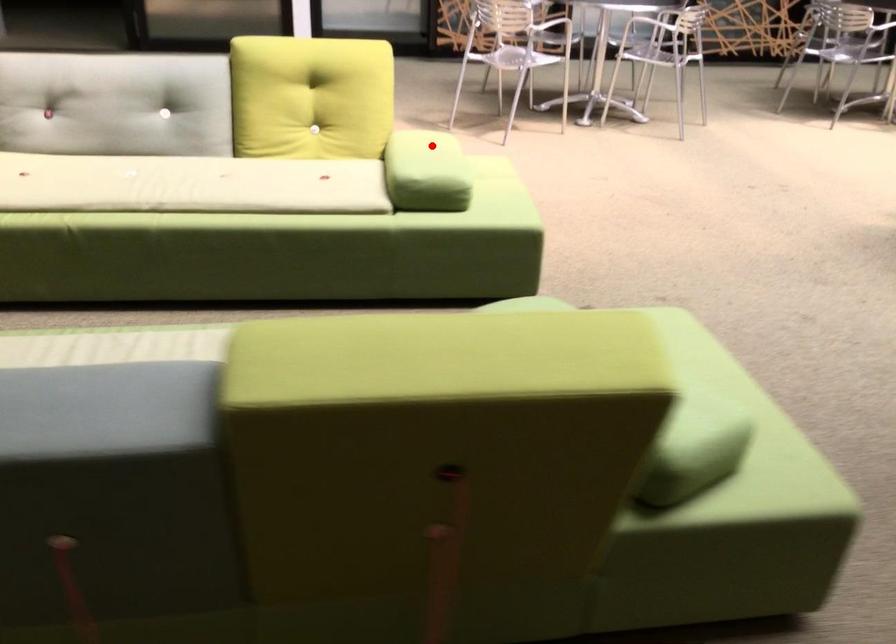
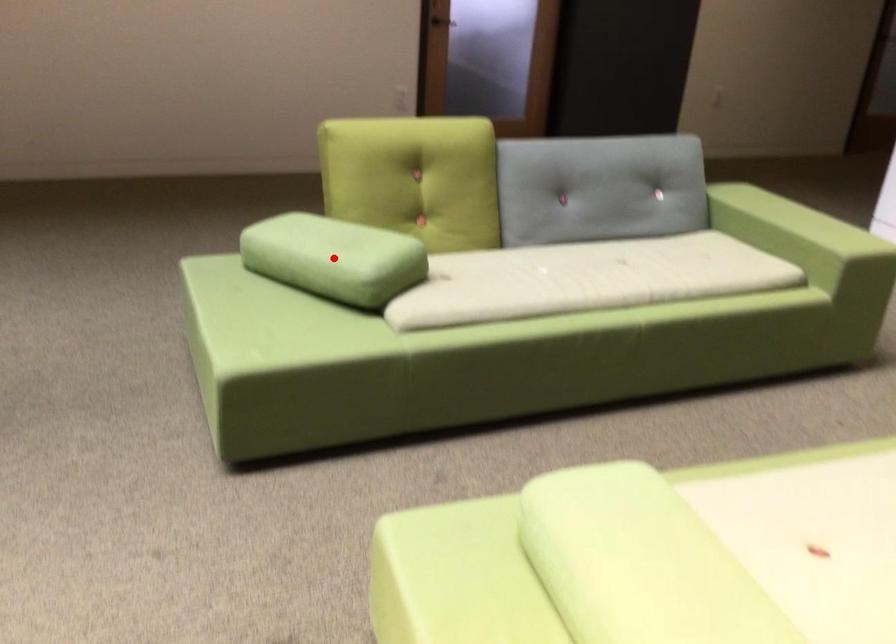
I am providing you with two images of the same scene from different viewpoints. A red point is marked on the first image and another point is marked on the second image. Do the highlighted points in image1 and image2 indicate the same real-world spot?

No